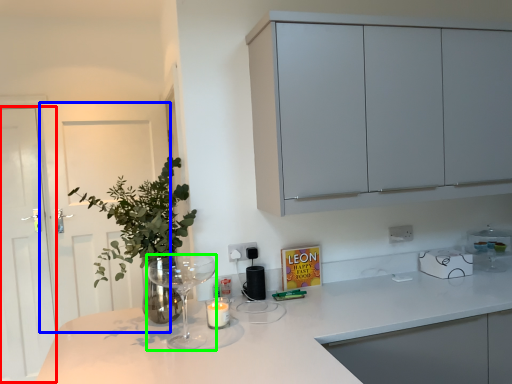
Question: Which object is the farthest from glass door (highlighted by a red box)? Choose among these: door (highlighted by a blue box) or wine glass (highlighted by a green box).

Choices:
 (A) door
 (B) wine glass

Answer: (B)